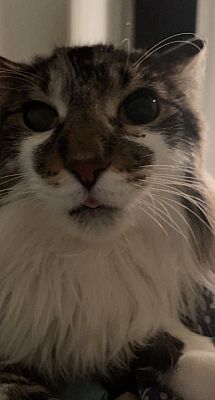
Where is `wall`? The height and width of the screenshot is (400, 215). wall is located at coordinates (22, 29).